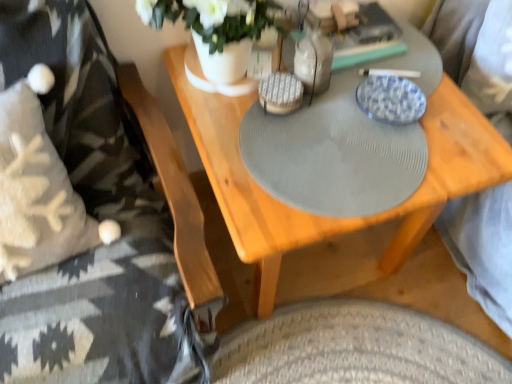
I want to click on free spot above wooden table at center (from a real-world perspective), so click(347, 119).